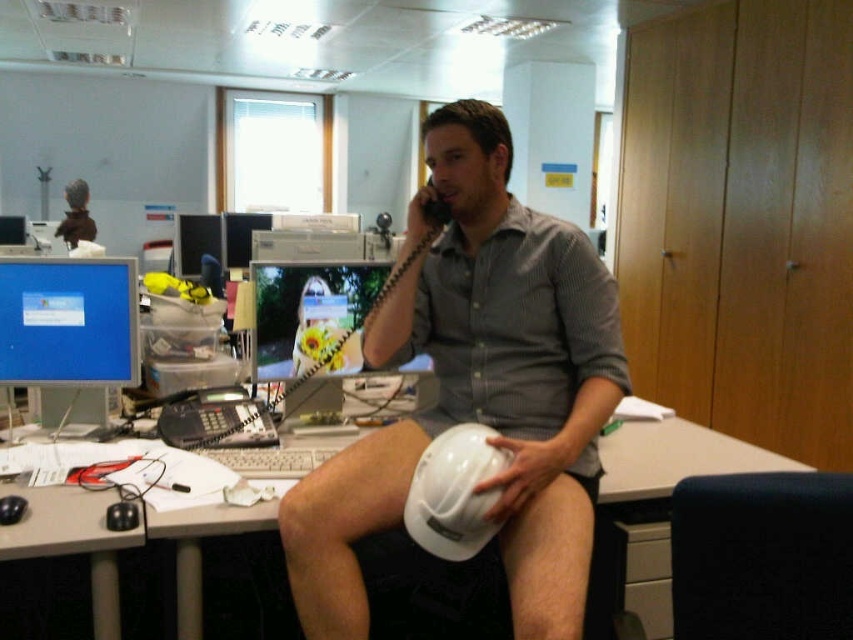
Between matte plastic monitor at center and white hard hat at center, which one has less height?

white hard hat at center

Is point (305, 308) more distant than point (444, 458)?

Yes, point (305, 308) is farther from viewer.

You are a GUI agent. You are given a task and a screenshot of the screen. Output one action in this format:
    pyautogui.click(x=<x>, y=<y>)
    Task: Click on the matte plastic monitor at center
    
    Given the screenshot: What is the action you would take?
    pyautogui.click(x=311, y=316)

Between white matte hard hat at center and matte plastic monitor at center, which one has less height?

Standing shorter between the two is matte plastic monitor at center.

Is white matte hard hat at center further to camera compared to matte plastic monitor at center?

No, white matte hard hat at center is closer to the viewer.

Between point (306, 525) and point (258, 372), which one is positioned in front?

Point (306, 525) is in front.

The height and width of the screenshot is (640, 853). Identify the location of white matte hard hat at center. (477, 388).

Between point (440, 552) and point (242, 266), which one is positioned in front?

Point (440, 552) is in front.

Locate an element on the screen. The height and width of the screenshot is (640, 853). white hard hat at center is located at coordinates (454, 492).

Is point (474, 451) more distant than point (222, 220)?

No.

Identify the location of white hard hat at center. The image size is (853, 640). (454, 492).